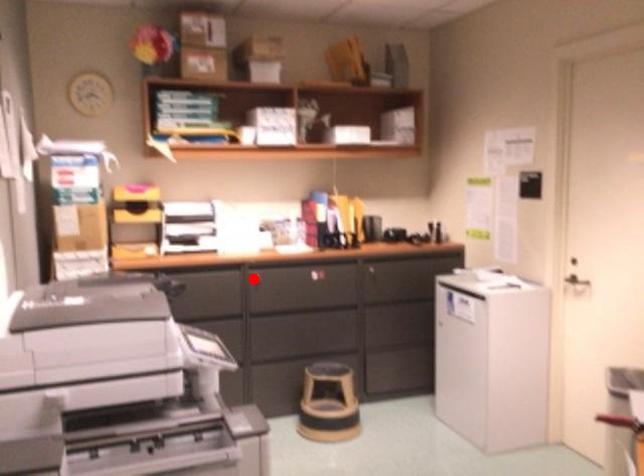
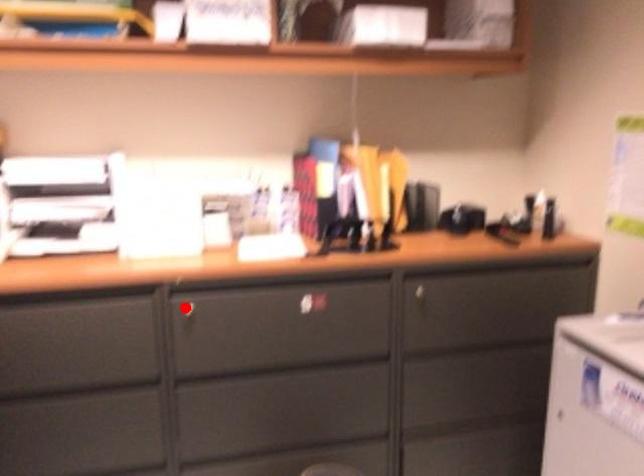
I am providing you with two images of the same scene from different viewpoints. A red point is marked on the first image and another point is marked on the second image. Is the red point in image1 aligned with the point shown in image2?

Yes